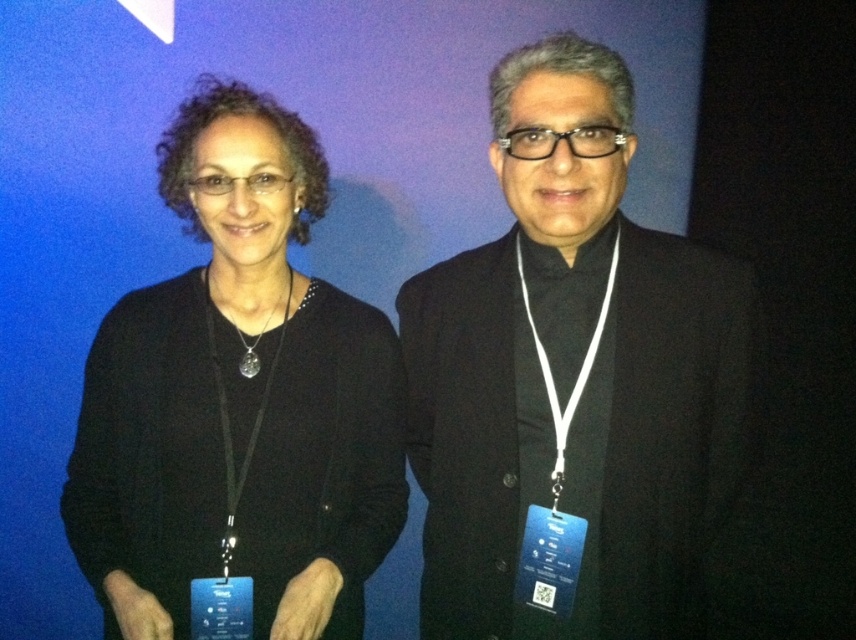
Can you confirm if black matte suit at center is positioned above black matte/black sweater at left?

Actually, black matte suit at center is below black matte/black sweater at left.

Between point (592, 410) and point (259, 513), which one is positioned in front?

Point (592, 410) is in front.

The width and height of the screenshot is (856, 640). What are the coordinates of `black matte suit at center` in the screenshot? It's located at (572, 380).